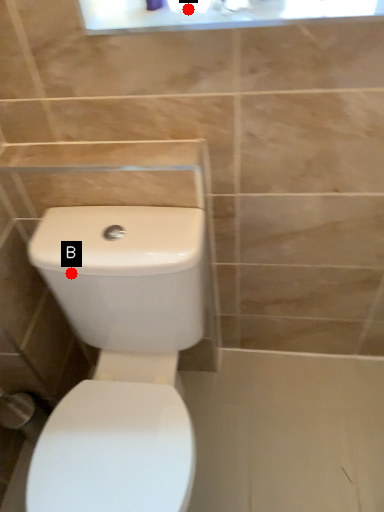
Question: Two points are circled on the image, labeled by A and B beside each circle. Among these points, which one is nearest to the camera?

Choices:
 (A) A is closer
 (B) B is closer

Answer: (A)